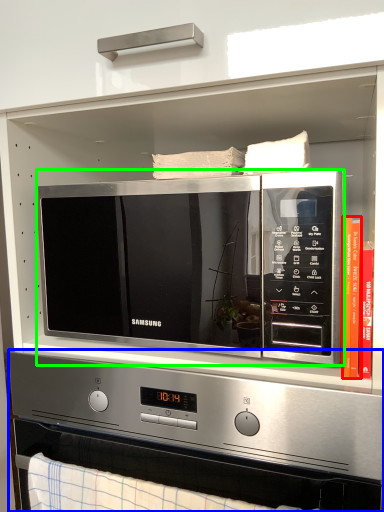
Question: Which object is positioned farthest from book (highlighted by a red box)? Select from appliance (highlighted by a blue box) and microwave oven (highlighted by a green box).

Choices:
 (A) appliance
 (B) microwave oven

Answer: (A)